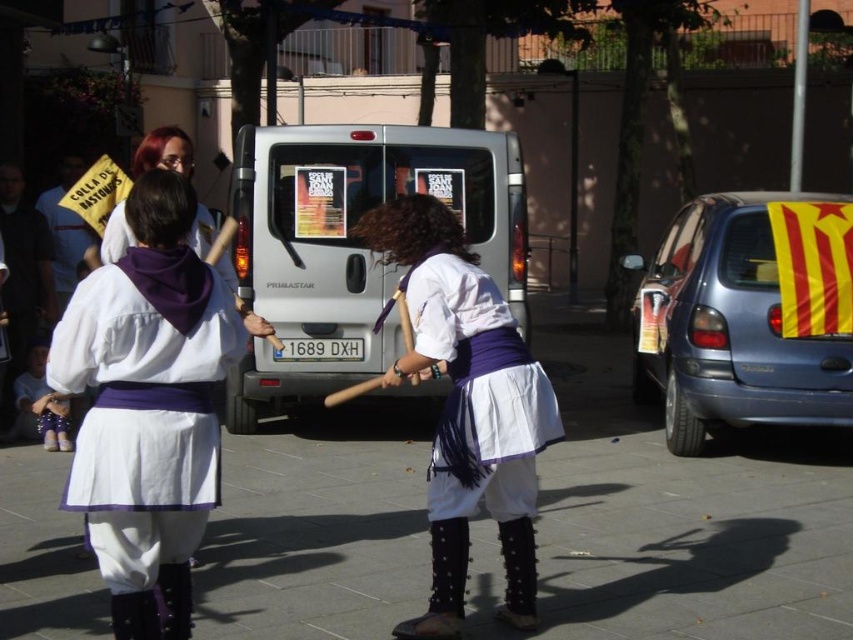
You are a delivery driver who needs to park your van on the white smooth pavement at center. Can you park your van there without blocking the silver metallic van at center?

The white smooth pavement at center is to the left of the silver metallic van at center. Since the pavement is positioned to the left of the van, parking there would not block the silver metallic van at center as they are on different sides.

You are a photographer trying to capture both the white cotton dress at center and the white cotton skirt at center in a single frame. Since you want to highlight the dress first, where should you position the camera relative to the subjects?

Position the camera to the right side of the subjects so that the white cotton dress at center appears on the left side of the frame, making it the first point of focus before the viewer notices the white cotton skirt at center on the right.